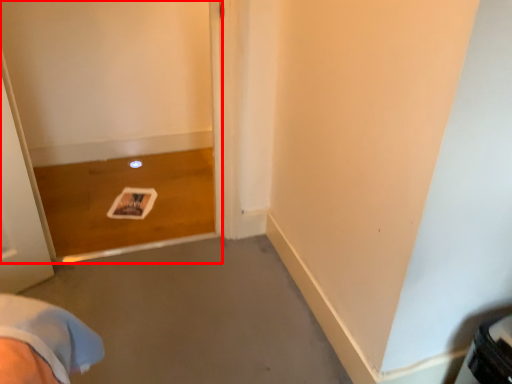
Question: From the image's perspective, considering the relative positions of screen door (annotated by the red box) and concrete in the image provided, where is screen door (annotated by the red box) located with respect to the staircase?

Choices:
 (A) above
 (B) below

Answer: (A)